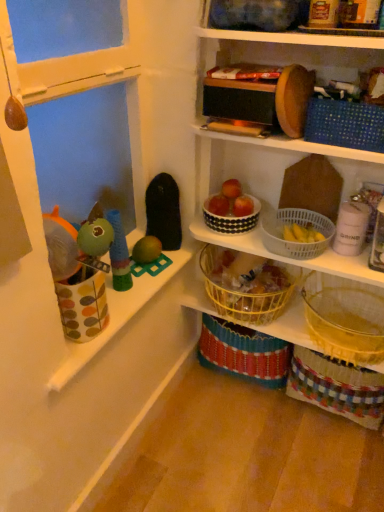
Locate an element on the screen. The image size is (384, 512). space that is in front of red matte apple at upper center, which is the second apple from right to left is located at coordinates (232, 207).